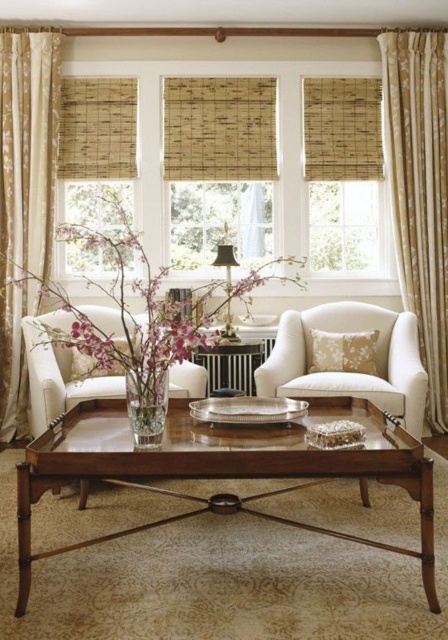
You are standing in the living room and want to place a small plant between the two points marked as point (72, 401) and point (310, 348). Which point should the plant be closer to in order to be nearer to the viewer?

The plant should be closer to point (72, 401) because it is nearer to the viewer compared to point (310, 348).

You are standing in the living room and see two points marked in the image. The first point is at coordinate point (332, 156) and the second is at coordinate point (210, 380). Which point is closer to you?

Point (210, 380) is closer to you because point (332, 156) is behind it.

You are a guest in this living room and want to place a small plant on the clear glass vase at center so it can be seen from the beige textured curtain at left. Is the plant visible from there?

The beige textured curtain at left is above the clear glass vase at center, so the plant placed on the clear glass vase at center would be visible from the beige textured curtain at left.